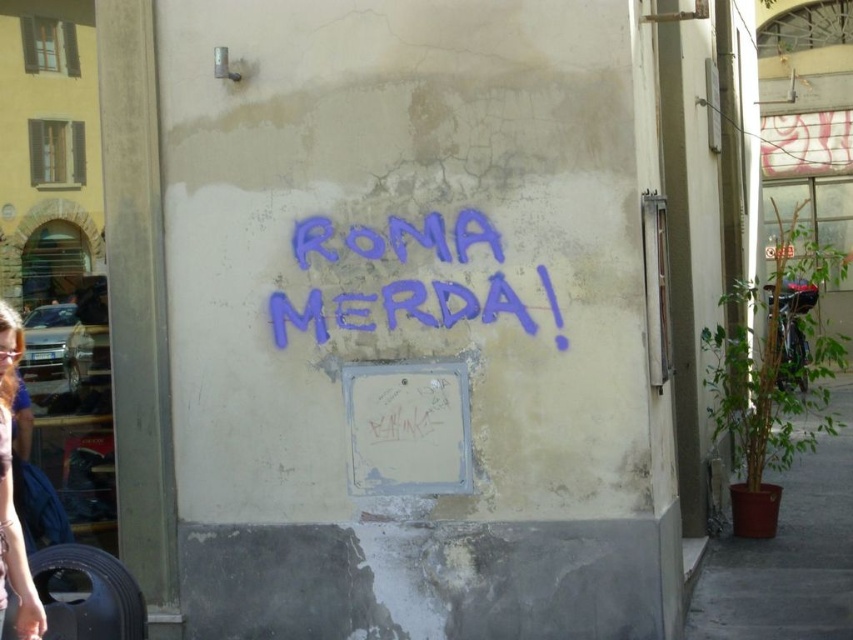
You are an artist trying to create a mural that matches the size of the purple spray paint graffiti at center. You have a matte purple shirt at lower left as a reference. Which object should you use as a size reference, and why?

You should use the purple spray paint graffiti at center as the size reference because its width is larger than the matte purple shirt at lower left, making it the correct scale for your mural.

You are an artist planning to create a mural on the wall. You have a purple spray paint graffiti at center and a matte purple shirt at lower left in your design. Which object in your design takes up more space on the wall?

The purple spray paint graffiti at center takes up more space on the wall because it is bigger than the matte purple shirt at lower left.